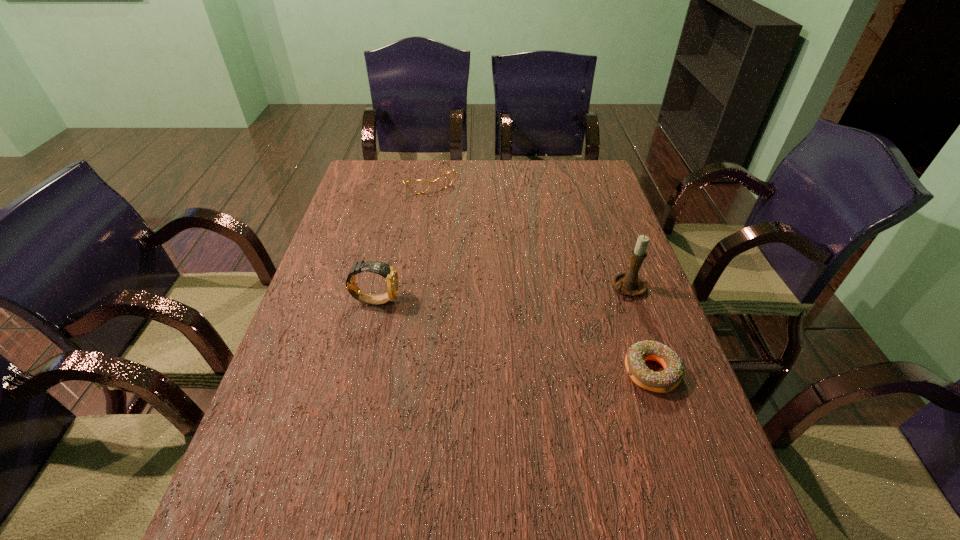
In the image, there is a desktop. Identify the location of free region at the far edge. This screenshot has width=960, height=540. (484, 165).

The image size is (960, 540). What are the coordinates of `free space at the left edge` in the screenshot? It's located at (347, 319).

Where is `vacant space at the right edge`? This screenshot has width=960, height=540. vacant space at the right edge is located at coordinates (575, 212).

Locate an element on the screen. This screenshot has height=540, width=960. vacant space at the far left corner of the desktop is located at coordinates (373, 192).

In the image, there is a desktop. Where is `vacant area at the near right corner`? vacant area at the near right corner is located at coordinates [x=655, y=457].

I want to click on free space between the second shortest object and the third shortest object, so click(400, 240).

Find the location of a particular element. vacant space that is in between the third shortest object and the nearest object is located at coordinates (514, 336).

Where is `empty space that is in between the nearest object and the watch`? Image resolution: width=960 pixels, height=540 pixels. empty space that is in between the nearest object and the watch is located at coordinates (514, 336).

This screenshot has width=960, height=540. I want to click on free point between the farthest object and the doughnut, so click(x=539, y=276).

The height and width of the screenshot is (540, 960). Identify the location of free point between the candle holder and the third shortest object. (501, 293).